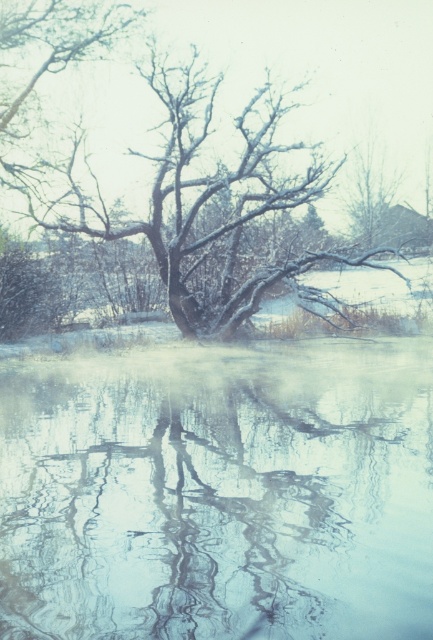
Which of these two, translucent icy water at center or snow-covered branches at center, stands taller?

snow-covered branches at center

Measure the distance between translucent icy water at center and camera.

They are 17.18 feet apart.

Who is more distant from viewer, (144,618) or (255,44)?

Point (255,44)

Where is `translucent icy water at center`? This screenshot has height=640, width=433. translucent icy water at center is located at coordinates tap(219, 493).